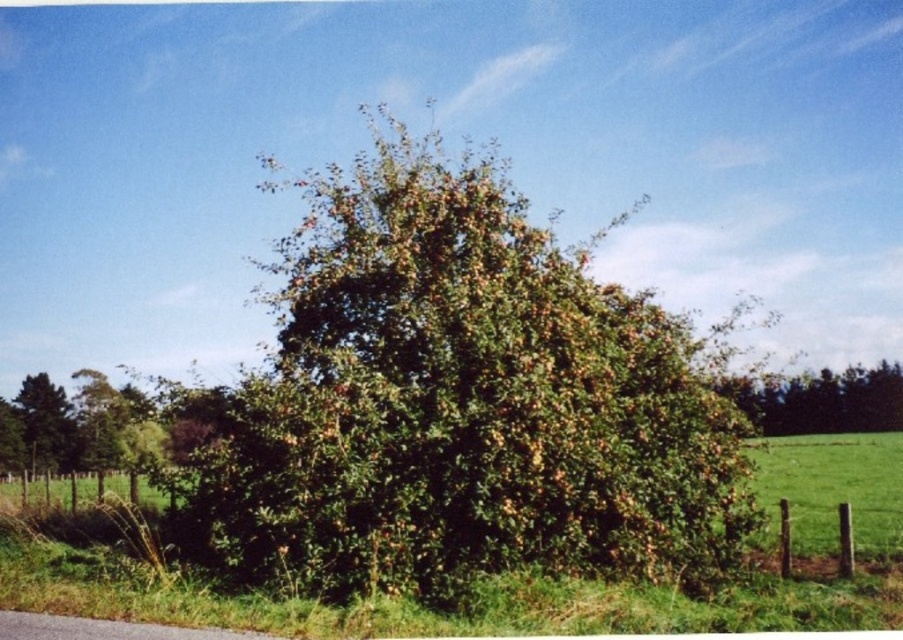
You are a gardener who needs to trim the green leafy bush at center and the green leafy tree at left. Based on their heights, which one will require a taller ladder?

The green leafy bush at center is much taller than the green leafy tree at left, so you will need a taller ladder for the green leafy bush at center.

Consider the image. You are standing on the paved road next to the wire fence. You see the green leafy bush at center and the green leafy tree at left. Which one is closer to the fence?

The green leafy bush at center is closer to the fence because it is located above the green leafy tree at left, meaning it is positioned nearer to the observer on the road.